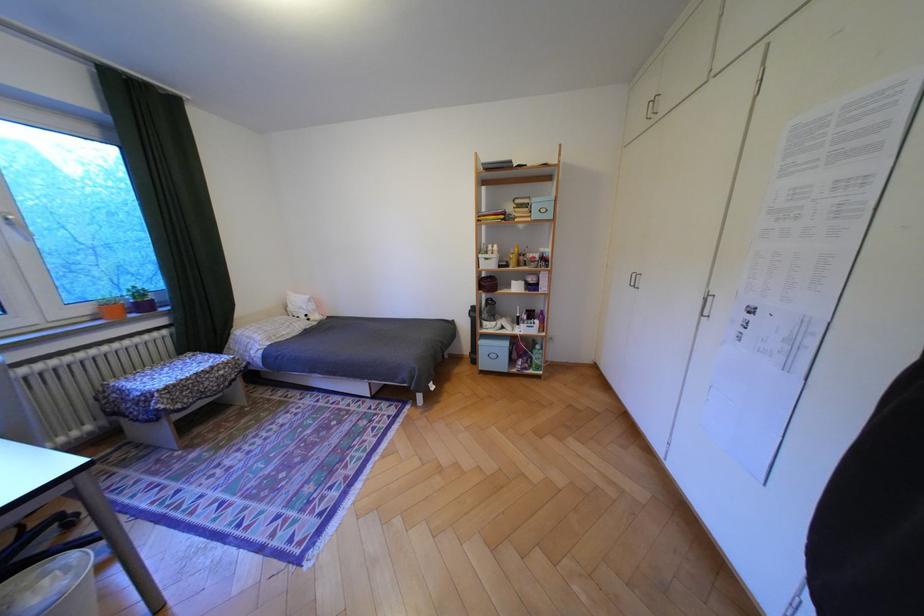
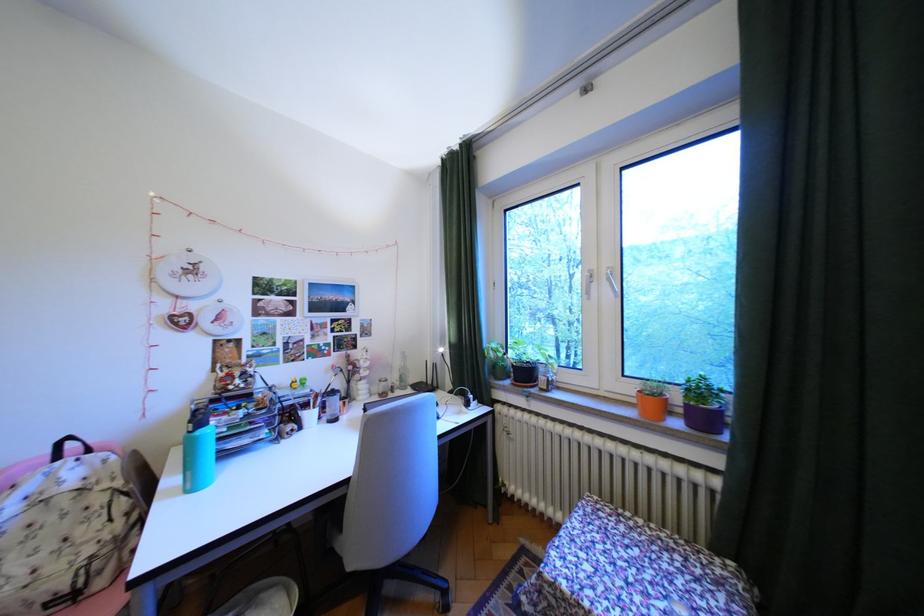
Locate, in the second image, the point that corresponds to point (177, 389) in the first image.

(564, 585)